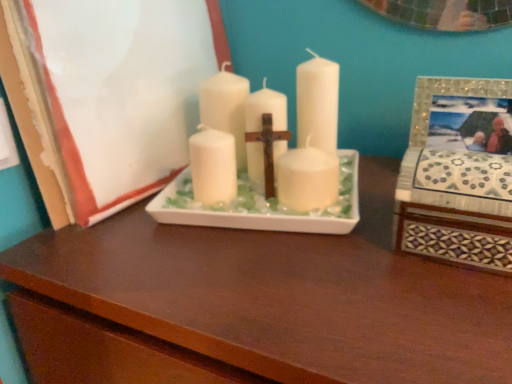
What do you see at coordinates (458, 174) in the screenshot? The width and height of the screenshot is (512, 384). I see `mosaic tile picture frame at right, which is the second picture frame from left to right` at bounding box center [458, 174].

Identify the location of white matte candle at center. (298, 138).

The width and height of the screenshot is (512, 384). What do you see at coordinates (112, 92) in the screenshot?
I see `matte white picture frame at center, placed as the second picture frame when sorted from right to left` at bounding box center [112, 92].

Locate an element on the screen. This screenshot has width=512, height=384. mosaic tile picture frame at right, which is the second picture frame from left to right is located at coordinates (458, 174).

Are mosaic tile picture frame at right, placed as the first picture frame when sorted from right to left, and matte white picture frame at center, placed as the second picture frame when sorted from right to left, beside each other?

No, mosaic tile picture frame at right, placed as the first picture frame when sorted from right to left, is not next to matte white picture frame at center, placed as the second picture frame when sorted from right to left.

Can you confirm if mosaic tile picture frame at right, which is the second picture frame from left to right, is wider than matte white picture frame at center, placed as the second picture frame when sorted from right to left?

Correct, the width of mosaic tile picture frame at right, which is the second picture frame from left to right, exceeds that of matte white picture frame at center, placed as the second picture frame when sorted from right to left.

In the image, is mosaic tile picture frame at right, placed as the first picture frame when sorted from right to left, positioned in front of or behind matte white picture frame at center, placed as the second picture frame when sorted from right to left?

Clearly, mosaic tile picture frame at right, placed as the first picture frame when sorted from right to left, is in front of matte white picture frame at center, placed as the second picture frame when sorted from right to left.

Is mosaic tile picture frame at right, placed as the first picture frame when sorted from right to left, to the left of matte white picture frame at center, placed as the second picture frame when sorted from right to left, from the viewer's perspective?

No.

Is white matte candle at center wider or thinner than mosaic tile picture frame at right, placed as the first picture frame when sorted from right to left?

Considering their sizes, white matte candle at center looks broader than mosaic tile picture frame at right, placed as the first picture frame when sorted from right to left.

Is white matte candle at center in contact with mosaic tile picture frame at right, placed as the first picture frame when sorted from right to left?

No, white matte candle at center is not beside mosaic tile picture frame at right, placed as the first picture frame when sorted from right to left.

From the image's perspective, is white matte candle at center on mosaic tile picture frame at right, placed as the first picture frame when sorted from right to left?

Yes, from the image's perspective, white matte candle at center is on top of mosaic tile picture frame at right, placed as the first picture frame when sorted from right to left.

Considering the sizes of objects matte white picture frame at center, the 1th picture frame in the left-to-right sequence, and matte white tray at center in the image provided, who is shorter, matte white picture frame at center, the 1th picture frame in the left-to-right sequence, or matte white tray at center?

matte white picture frame at center, the 1th picture frame in the left-to-right sequence.

Considering the relative sizes of matte white picture frame at center, the 1th picture frame in the left-to-right sequence, and matte white tray at center in the image provided, is matte white picture frame at center, the 1th picture frame in the left-to-right sequence, thinner than matte white tray at center?

Indeed, matte white picture frame at center, the 1th picture frame in the left-to-right sequence, has a lesser width compared to matte white tray at center.

From the image's perspective, would you say matte white picture frame at center, the 1th picture frame in the left-to-right sequence, is shown under matte white tray at center?

No, from the image's perspective, matte white picture frame at center, the 1th picture frame in the left-to-right sequence, is not below matte white tray at center.

Is matte white picture frame at center, the 1th picture frame in the left-to-right sequence, to the left of matte white tray at center from the viewer's perspective?

Yes, matte white picture frame at center, the 1th picture frame in the left-to-right sequence, is to the left of matte white tray at center.

Which is more to the right, matte white tray at center or mosaic tile picture frame at right, which is the second picture frame from left to right?

mosaic tile picture frame at right, which is the second picture frame from left to right.

Is matte white tray at center wider or thinner than mosaic tile picture frame at right, which is the second picture frame from left to right?

Considering their sizes, matte white tray at center looks broader than mosaic tile picture frame at right, which is the second picture frame from left to right.

You are a GUI agent. You are given a task and a screenshot of the screen. Output one action in this format:
    pyautogui.click(x=<x>, y=<y>)
    Task: Click on the table lying on the left of mosaic tile picture frame at right, which is the second picture frame from left to right
    
    Given the screenshot: What is the action you would take?
    [x=265, y=302]

Looking at the image, does mosaic tile picture frame at right, placed as the first picture frame when sorted from right to left, seem bigger or smaller compared to matte white tray at center?

In the image, mosaic tile picture frame at right, placed as the first picture frame when sorted from right to left, appears to be smaller than matte white tray at center.

Is mosaic tile picture frame at right, which is the second picture frame from left to right, far away from matte white tray at center?

That's not correct — mosaic tile picture frame at right, which is the second picture frame from left to right, is a little close to matte white tray at center.

From a real-world perspective, which object rests below the other?

matte white tray at center is physically lower.

Can you confirm if mosaic tile picture frame at right, which is the second picture frame from left to right, is wider than matte white tray at center?

No, mosaic tile picture frame at right, which is the second picture frame from left to right, is not wider than matte white tray at center.

Consider the image. Is matte white tray at center shorter than matte white picture frame at center, placed as the second picture frame when sorted from right to left?

No, matte white tray at center is not shorter than matte white picture frame at center, placed as the second picture frame when sorted from right to left.

Does matte white tray at center turn towards matte white picture frame at center, placed as the second picture frame when sorted from right to left?

No, matte white tray at center is not oriented towards matte white picture frame at center, placed as the second picture frame when sorted from right to left.

Would you say matte white tray at center is inside or outside matte white picture frame at center, the 1th picture frame in the left-to-right sequence?

matte white tray at center is not enclosed by matte white picture frame at center, the 1th picture frame in the left-to-right sequence.

Is there a large distance between matte white tray at center and matte white picture frame at center, the 1th picture frame in the left-to-right sequence?

No, matte white tray at center is not far away from matte white picture frame at center, the 1th picture frame in the left-to-right sequence.

Where is `candle above the matte white tray at center (from the image's perspective)`? candle above the matte white tray at center (from the image's perspective) is located at coordinates (298, 138).

Is white matte candle at center bigger than matte white tray at center?

Incorrect, white matte candle at center is not larger than matte white tray at center.

Looking at this image, does white matte candle at center touch matte white tray at center?

No, white matte candle at center is not touching matte white tray at center.

Considering the relative sizes of white matte candle at center and matte white tray at center in the image provided, is white matte candle at center shorter than matte white tray at center?

Yes.

I want to click on picture frame above the mosaic tile picture frame at right, which is the second picture frame from left to right (from a real-world perspective), so click(x=112, y=92).

Locate an element on the screen. The height and width of the screenshot is (384, 512). candle above the mosaic tile picture frame at right, placed as the first picture frame when sorted from right to left (from the image's perspective) is located at coordinates (298, 138).

From the picture: Which object lies nearer to the anchor point white matte candle at center, matte white tray at center or mosaic tile picture frame at right, which is the second picture frame from left to right?

Among the two, mosaic tile picture frame at right, which is the second picture frame from left to right, is located nearer to white matte candle at center.

Consider the image. From the image, which object appears to be nearer to white matte candle at center, matte white picture frame at center, the 1th picture frame in the left-to-right sequence, or mosaic tile picture frame at right, placed as the first picture frame when sorted from right to left?

mosaic tile picture frame at right, placed as the first picture frame when sorted from right to left, is positioned closer to the anchor white matte candle at center.

Looking at the image, which one is located further to mosaic tile picture frame at right, which is the second picture frame from left to right, matte white picture frame at center, placed as the second picture frame when sorted from right to left, or white matte candle at center?

matte white picture frame at center, placed as the second picture frame when sorted from right to left.

Looking at this image, when comparing their distances from white matte candle at center, does matte white picture frame at center, the 1th picture frame in the left-to-right sequence, or matte white tray at center seem closer?

matte white tray at center.

Considering their positions, is mosaic tile picture frame at right, placed as the first picture frame when sorted from right to left, positioned closer to matte white tray at center than matte white picture frame at center, placed as the second picture frame when sorted from right to left?

Among the two, mosaic tile picture frame at right, placed as the first picture frame when sorted from right to left, is located nearer to matte white tray at center.

Which object lies further to the anchor point matte white picture frame at center, placed as the second picture frame when sorted from right to left, white matte candle at center or matte white tray at center?

matte white tray at center lies further to matte white picture frame at center, placed as the second picture frame when sorted from right to left, than the other object.

When comparing their distances from matte white picture frame at center, placed as the second picture frame when sorted from right to left, does matte white tray at center or mosaic tile picture frame at right, which is the second picture frame from left to right, seem closer?

Based on the image, matte white tray at center appears to be nearer to matte white picture frame at center, placed as the second picture frame when sorted from right to left.

Which object lies further to the anchor point matte white tray at center, matte white picture frame at center, placed as the second picture frame when sorted from right to left, or mosaic tile picture frame at right, placed as the first picture frame when sorted from right to left?

matte white picture frame at center, placed as the second picture frame when sorted from right to left, is further to matte white tray at center.

Image resolution: width=512 pixels, height=384 pixels. In order to click on candle between matte white picture frame at center, the 1th picture frame in the left-to-right sequence, and mosaic tile picture frame at right, placed as the first picture frame when sorted from right to left in this screenshot , I will do `click(298, 138)`.

Find the location of a particular element. This screenshot has width=512, height=384. picture frame between matte white picture frame at center, the 1th picture frame in the left-to-right sequence, and matte white tray at center in the up-down direction is located at coordinates (458, 174).

Where is `candle between matte white picture frame at center, the 1th picture frame in the left-to-right sequence, and matte white tray at center vertically`? The width and height of the screenshot is (512, 384). candle between matte white picture frame at center, the 1th picture frame in the left-to-right sequence, and matte white tray at center vertically is located at coordinates (298, 138).

The height and width of the screenshot is (384, 512). I want to click on picture frame between white matte candle at center and matte white tray at center vertically, so click(458, 174).